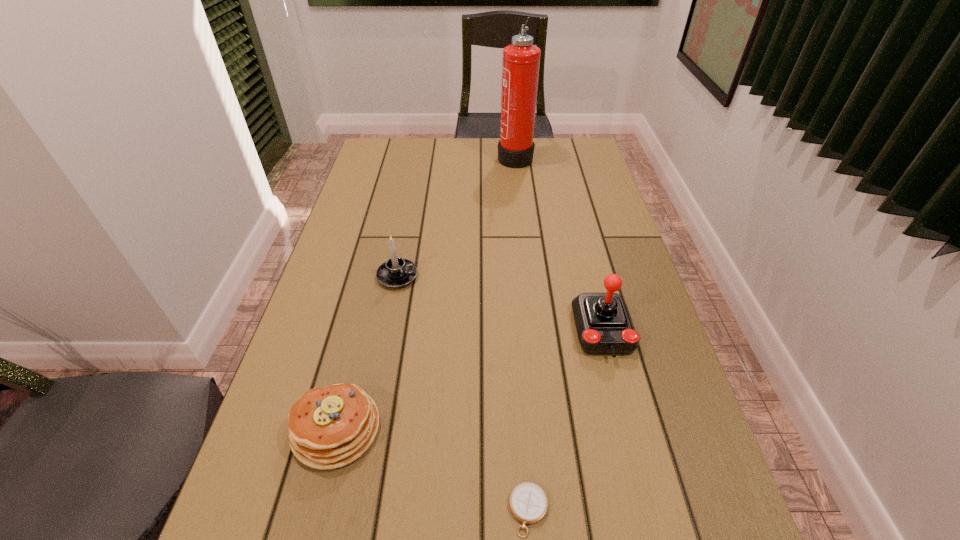
You are a GUI agent. You are given a task and a screenshot of the screen. Output one action in this format:
    pyautogui.click(x=<x>, y=<y>)
    Task: Click on the vacant area that lies between the farthest object and the joystick
    The height and width of the screenshot is (540, 960).
    Given the screenshot: What is the action you would take?
    pyautogui.click(x=559, y=244)

This screenshot has width=960, height=540. In order to click on empty space between the pancake and the tallest object in this screenshot , I will do `click(425, 292)`.

Identify the location of empty location between the fourth nearest object and the shortest object. (463, 393).

Where is `the second closest object relative to the fire extinguisher`? the second closest object relative to the fire extinguisher is located at coordinates (604, 326).

You are a GUI agent. You are given a task and a screenshot of the screen. Output one action in this format:
    pyautogui.click(x=<x>, y=<y>)
    Task: Click on the object that is the third closest to the joystick
    
    Given the screenshot: What is the action you would take?
    pyautogui.click(x=331, y=427)

Find the location of a particular element. The image size is (960, 540). free space that satisfies the following two spatial constraints: 1. with a handle on the side of the fourth nearest object; 2. on the front side of the second nearest object is located at coordinates (368, 428).

Identify the location of vacant space that satisfies the following two spatial constraints: 1. on the back side of the compass; 2. with a handle on the side of the candle holder. tap(512, 276).

You are a GUI agent. You are given a task and a screenshot of the screen. Output one action in this format:
    pyautogui.click(x=<x>, y=<y>)
    Task: Click on the free space that satisfies the following two spatial constraints: 1. with a handle on the side of the candle holder; 2. on the left side of the compass
    
    Given the screenshot: What is the action you would take?
    pyautogui.click(x=352, y=510)